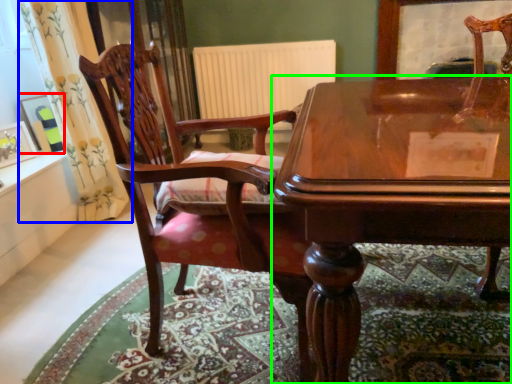
Question: Which object is the closest to the picture frame (highlighted by a red box)? Choose among these: curtain (highlighted by a blue box) or table (highlighted by a green box).

Choices:
 (A) curtain
 (B) table

Answer: (A)